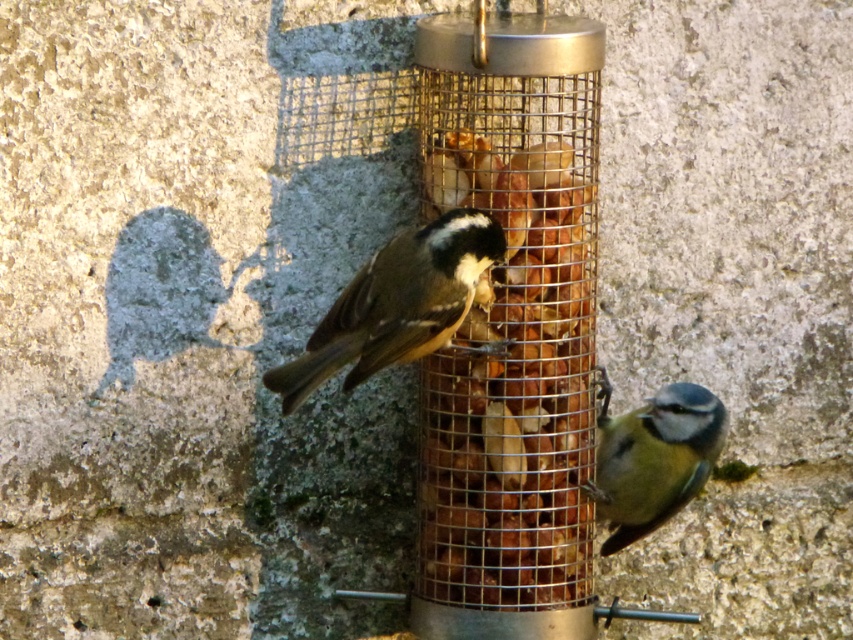
Does point (378, 324) lie behind point (628, 493)?

No, (378, 324) is closer to viewer.

Which is below, brown matte bird at center or blue matte bird at lower right?

Positioned lower is blue matte bird at lower right.

The image size is (853, 640). Identify the location of brown matte bird at center. tap(396, 304).

Identify the location of brown matte bird at center. This screenshot has width=853, height=640. (396, 304).

Does point (469, 326) come in front of point (676, 449)?

That is True.

Is brown textured nuts at center to the left of blue matte bird at lower right from the viewer's perspective?

Correct, you'll find brown textured nuts at center to the left of blue matte bird at lower right.

Identify the location of brown textured nuts at center. The height and width of the screenshot is (640, 853). (512, 394).

I want to click on brown textured nuts at center, so click(512, 394).

Is brown textured nuts at center further to camera compared to brown matte bird at center?

Yes, brown textured nuts at center is further from the viewer.

Based on the photo, who is shorter, brown textured nuts at center or brown matte bird at center?

brown matte bird at center is shorter.

I want to click on brown textured nuts at center, so click(512, 394).